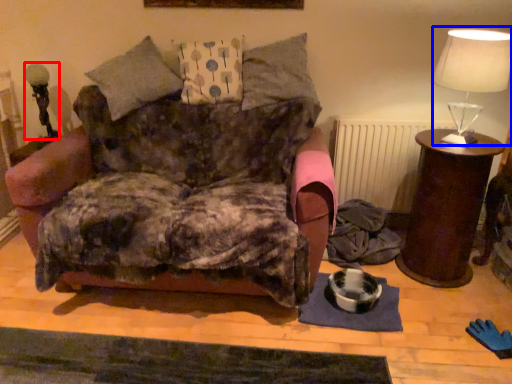
Question: Among these objects, which one is nearest to the camera, table lamp (highlighted by a red box) or table lamp (highlighted by a blue box)?

Choices:
 (A) table lamp
 (B) table lamp

Answer: (B)